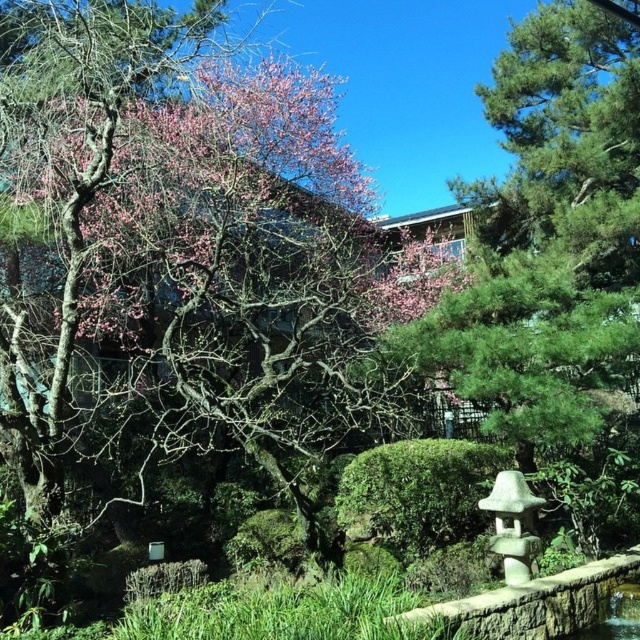
Between pink textured bark at upper left and white stone lantern at lower right, which one appears on the right side from the viewer's perspective?

From the viewer's perspective, white stone lantern at lower right appears more on the right side.

Measure the distance between point (x=276, y=323) and camera.

12.65 feet

The height and width of the screenshot is (640, 640). In order to click on pink textured bark at upper left in this screenshot , I will do `click(180, 256)`.

I want to click on pink textured bark at upper left, so click(180, 256).

Which of these two, pink textured bark at upper left or green textured pine tree at center, stands taller?

Standing taller between the two is pink textured bark at upper left.

This screenshot has width=640, height=640. Describe the element at coordinates (180, 256) in the screenshot. I see `pink textured bark at upper left` at that location.

You are a GUI agent. You are given a task and a screenshot of the screen. Output one action in this format:
    pyautogui.click(x=<x>, y=<y>)
    Task: Click on the pink textured bark at upper left
    The height and width of the screenshot is (640, 640).
    Given the screenshot: What is the action you would take?
    pyautogui.click(x=180, y=256)

Is green textured pine tree at center positioned at the back of white stone lantern at lower right?

Yes.

Between green textured pine tree at center and white stone lantern at lower right, which one is positioned higher?

Positioned higher is green textured pine tree at center.

Who is more distant from viewer, (552, 440) or (509, 518)?

Positioned behind is point (552, 440).

The height and width of the screenshot is (640, 640). Find the location of `green textured pine tree at center`. green textured pine tree at center is located at coordinates (550, 236).